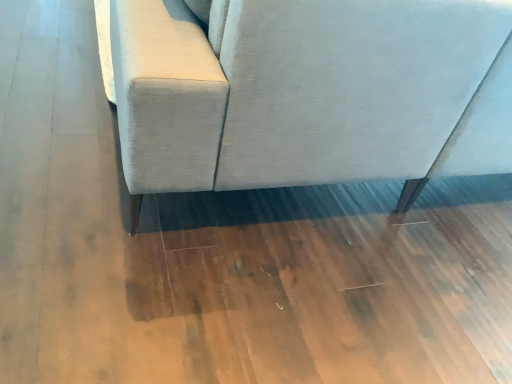
Measure the distance between light gray fabric couch at center and camera.

light gray fabric couch at center and camera are 31.91 inches apart from each other.

What do you see at coordinates (307, 92) in the screenshot? I see `light gray fabric couch at center` at bounding box center [307, 92].

Locate an element on the screen. Image resolution: width=512 pixels, height=384 pixels. light gray fabric couch at center is located at coordinates (307, 92).

You are a GUI agent. You are given a task and a screenshot of the screen. Output one action in this format:
    pyautogui.click(x=<x>, y=<y>)
    Task: Click on the light gray fabric couch at center
    The width and height of the screenshot is (512, 384).
    Given the screenshot: What is the action you would take?
    pyautogui.click(x=307, y=92)